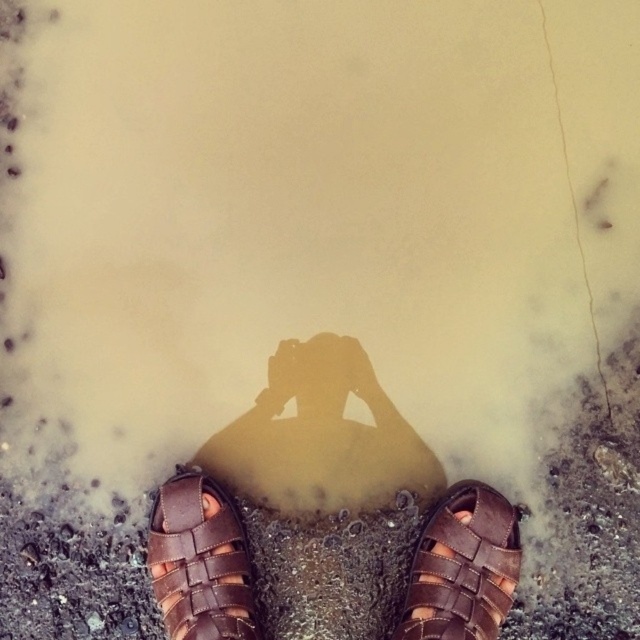
You are a photographer trying to capture the reflection of the sandals in the water. Which sandal, the brown leather sandals at lower center or the brown leather sandal at lower center, is closer to the left edge of the water surface?

The brown leather sandals at lower center is positioned on the left side of brown leather sandal at lower center, so the brown leather sandals at lower center is closer to the left edge of the water surface.

You are a delivery robot with a 16 inch wide package. You need to place the package between the brown leather sandal at lower left and the brown leather sandal at lower center. Can you fit the package between them?

The brown leather sandal at lower left and brown leather sandal at lower center are 14.57 inches apart from each other. Since the package is 16 inches wide, it cannot fit between them as the space is narrower than the package.